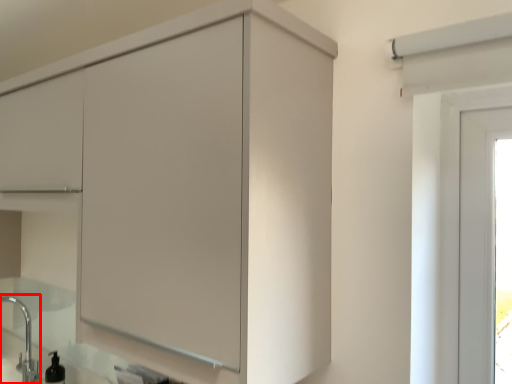
Question: From the image's perspective, considering the relative positions of faucet (annotated by the red box) and cupboard in the image provided, where is faucet (annotated by the red box) located with respect to the staircase?

Choices:
 (A) above
 (B) below

Answer: (B)